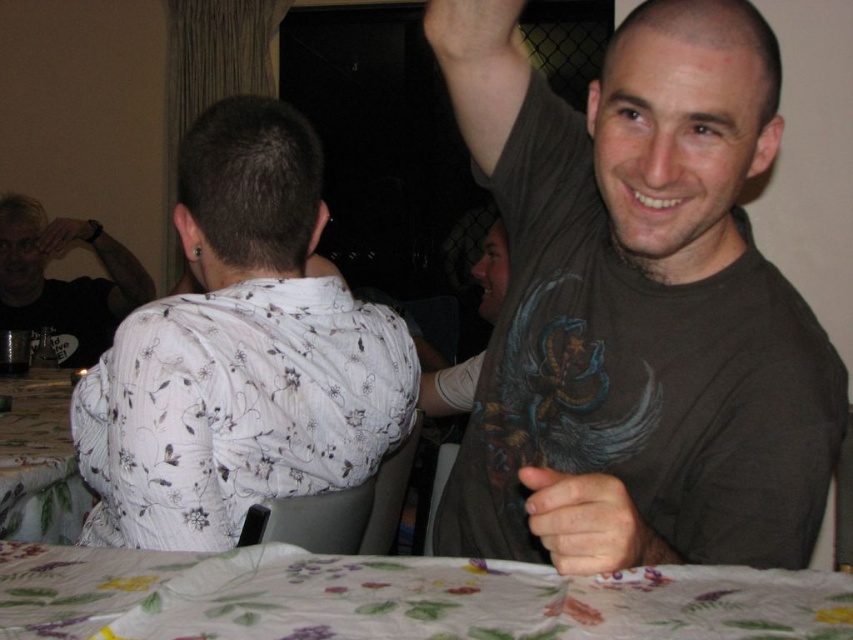
Question: Is the position of dark brown t-shirt at upper right more distant than that of floral printed fabric at lower center?

Choices:
 (A) yes
 (B) no

Answer: (A)

Question: Which point appears farthest from the camera in this image?

Choices:
 (A) (619, 502)
 (B) (695, 250)
 (C) (456, 378)
 (D) (45, 234)

Answer: (D)

Question: Does matte black shirt at left have a lesser width compared to matte black arm at upper left?

Choices:
 (A) yes
 (B) no

Answer: (B)

Question: Which object appears closest to the camera in this image?

Choices:
 (A) matte gray shirt at upper center
 (B) floral fabric tablecloth at lower left

Answer: (B)

Question: Considering the relative positions of floral fabric tablecloth at lower left and matte gray shirt at upper center in the image provided, where is floral fabric tablecloth at lower left located with respect to matte gray shirt at upper center?

Choices:
 (A) below
 (B) above

Answer: (A)

Question: Which object is the closest to the smooth skin hand at center?

Choices:
 (A) floral printed fabric at lower center
 (B) matte black ring at upper left

Answer: (A)